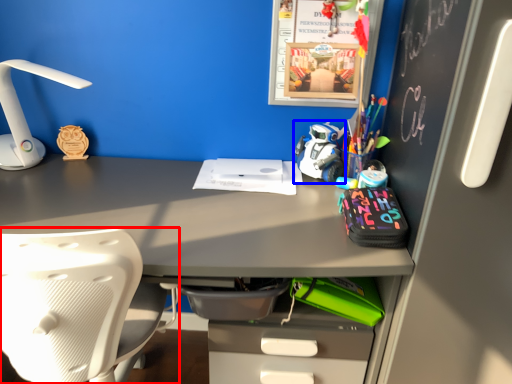
Question: Which object appears farthest to the camera in this image, chair (highlighted by a red box) or toy (highlighted by a blue box)?

Choices:
 (A) chair
 (B) toy

Answer: (B)